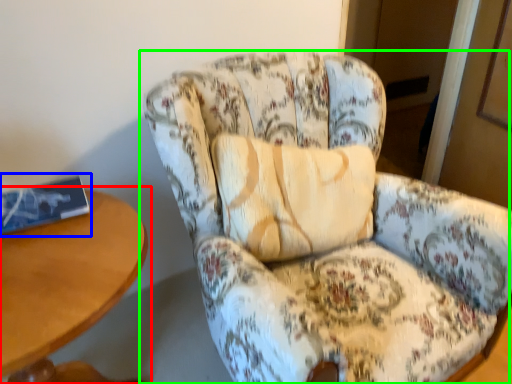
Question: Which object is positioned closest to table (highlighted by a red box)? Select from book (highlighted by a blue box) and chair (highlighted by a green box).

Choices:
 (A) book
 (B) chair

Answer: (A)